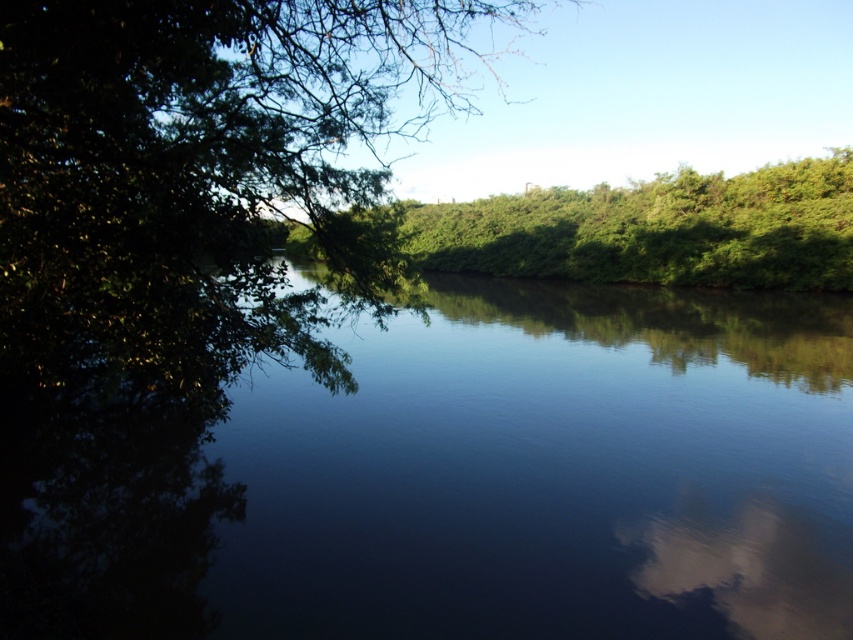
Question: Is dark reflective water at center positioned behind green leafy tree at left?

Choices:
 (A) yes
 (B) no

Answer: (A)

Question: Can you confirm if dark reflective water at center is positioned to the right of green leafy trees at center?

Choices:
 (A) no
 (B) yes

Answer: (B)

Question: Does dark reflective water at center lie behind green leafy tree at left?

Choices:
 (A) yes
 (B) no

Answer: (A)

Question: Which object is closer to the camera taking this photo?

Choices:
 (A) dark reflective water at center
 (B) green leafy trees at center
 (C) green leafy tree at left

Answer: (C)

Question: Which object is positioned farthest from the dark reflective water at center?

Choices:
 (A) green leafy tree at left
 (B) green leafy trees at center

Answer: (B)

Question: Estimate the real-world distances between objects in this image. Which object is closer to the green leafy trees at center?

Choices:
 (A) green leafy tree at left
 (B) dark reflective water at center

Answer: (A)